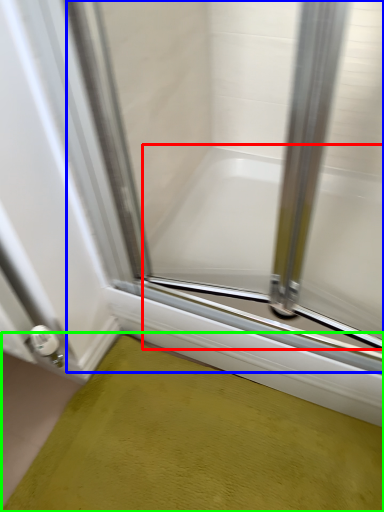
Question: Which is nearer to the bathtub (highlighted by a red box)? glass door (highlighted by a blue box) or bath mat (highlighted by a green box).

Choices:
 (A) glass door
 (B) bath mat

Answer: (A)